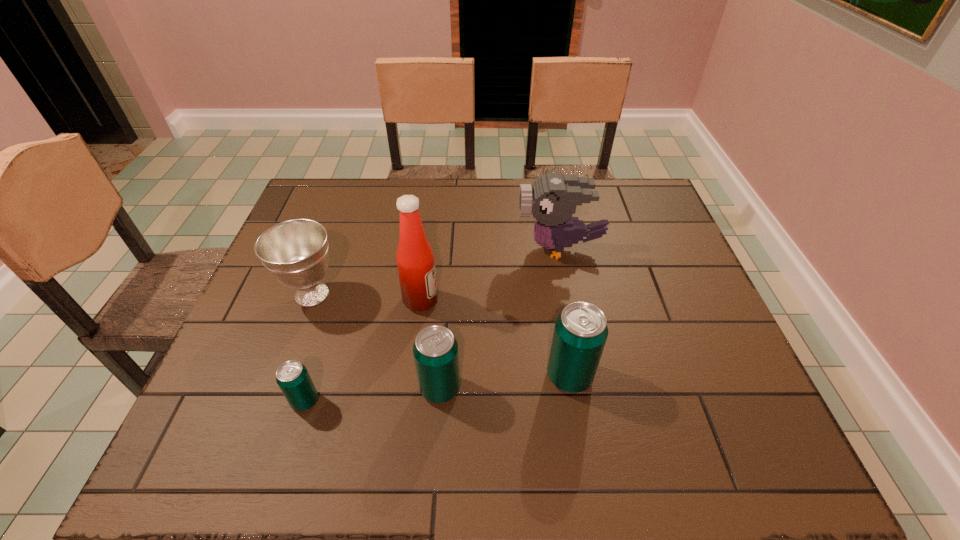
In the current image, all beer cans are evenly spaced. To maintain this equal spacing, where should an additional beer can be placed on the right? Please point out a free spot. Please provide its 2D coordinates. Your answer should be formatted as a tuple, i.e. [(x, y)], where the tuple contains the x and y coordinates of a point satisfying the conditions above.

[(693, 365)]